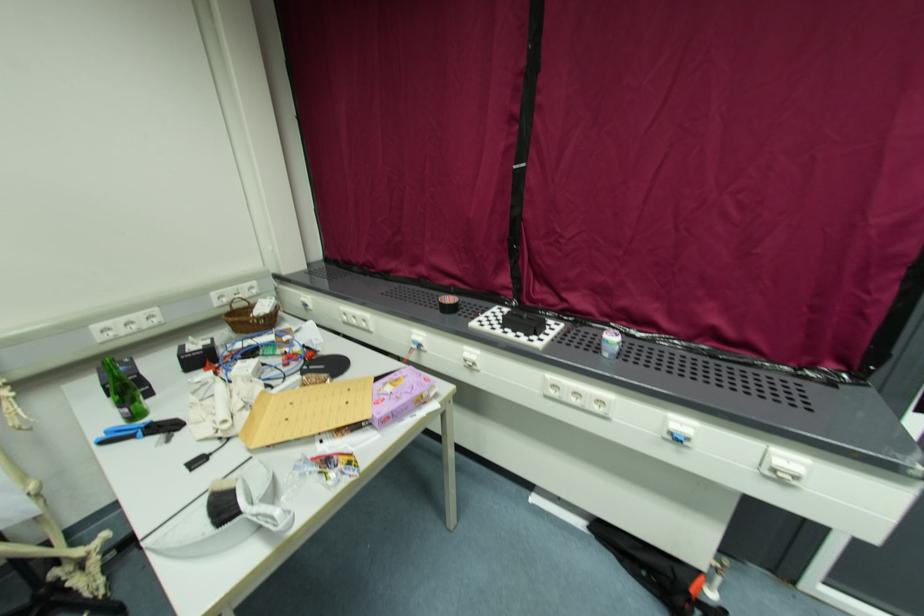
Describe the element at coordinates (116, 434) in the screenshot. I see `the blue tool handles` at that location.